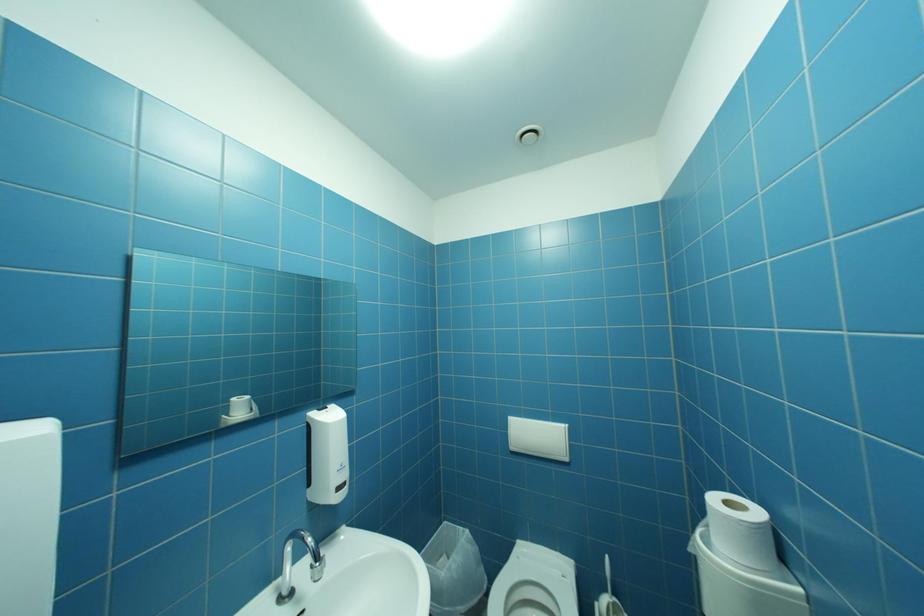
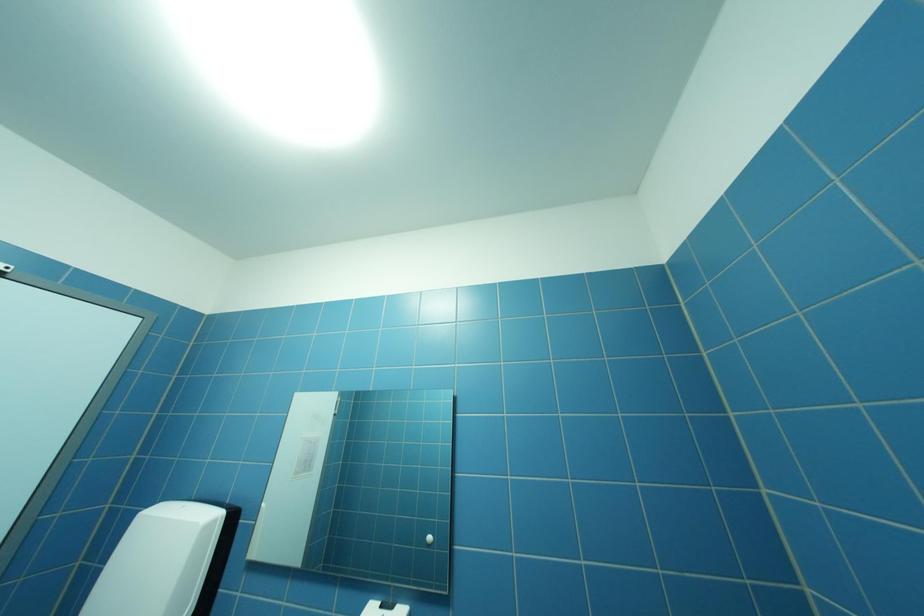
Based on the continuous images, in which direction is the camera rotating?

The camera rotated toward left-up.